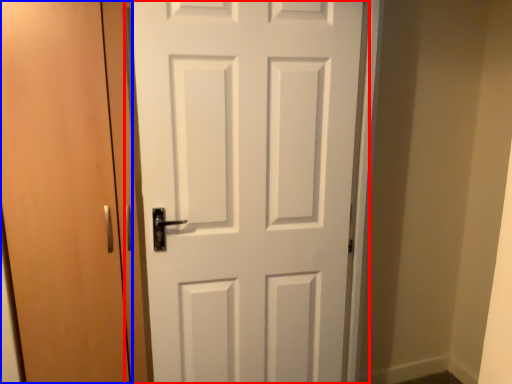
Question: Which of the following is the closest to the observer, door (highlighted by a red box) or door (highlighted by a blue box)?

Choices:
 (A) door
 (B) door

Answer: (A)